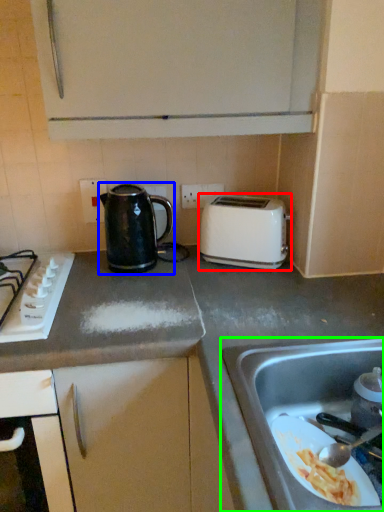
Question: Estimate the real-world distances between objects in this image. Which object is farther from toaster (highlighted by a red box), kettle (highlighted by a blue box) or sink (highlighted by a green box)?

Choices:
 (A) kettle
 (B) sink

Answer: (B)